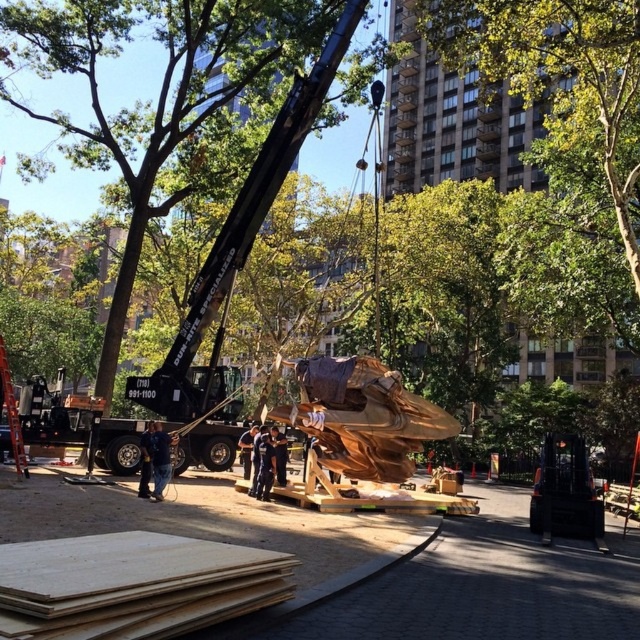
You are a construction worker who needs to place a heavy object on the wooden boards at center. However, there is plywood at lower left nearby. Which object should you use as a base to ensure stability, and why?

You should use the wooden boards at center as the base because it is positioned to the right of the plywood at lower left, making it more accessible and stable for placing heavy objects.

You are an urban planner reviewing this installation site. There is a wooden boards at center marked by point (481, 586). What is the purpose of this wooden boards at center in the context of the sculpture installation?

The wooden boards at center marked by point (481, 586) are likely used as a temporary platform or base to support the sculpture during its installation process, ensuring stability while it is being positioned or secured in place.

You are a construction worker who needs to place a heavy object on a surface. You have two options available in the scene, the wooden boards at center and the plywood at lower left. Based on their sizes, which surface is more suitable for supporting the heavy object?

The wooden boards at center has a larger size compared to plywood at lower left, so the wooden boards at center is more suitable for supporting the heavy object because it provides a larger and more stable base.